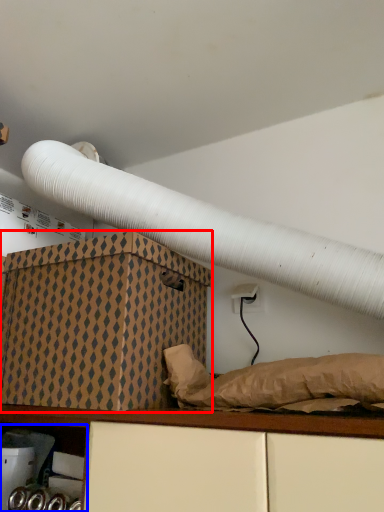
Question: Which object is further to the camera taking this photo, box (highlighted by a red box) or shelf (highlighted by a blue box)?

Choices:
 (A) box
 (B) shelf

Answer: (B)